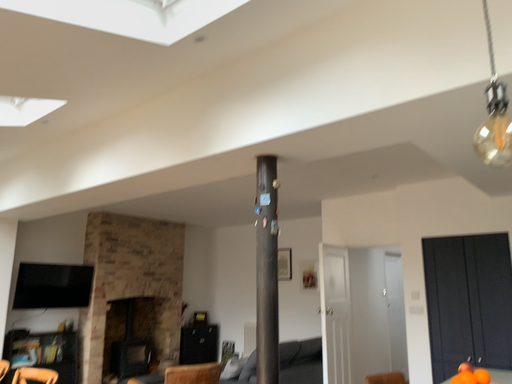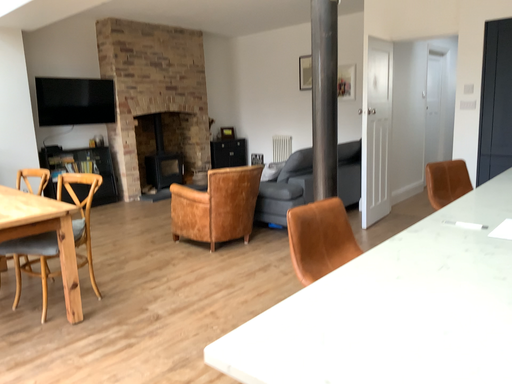
Question: Which way did the camera rotate in the video?

Choices:
 (A) rotated downward
 (B) rotated upward

Answer: (A)